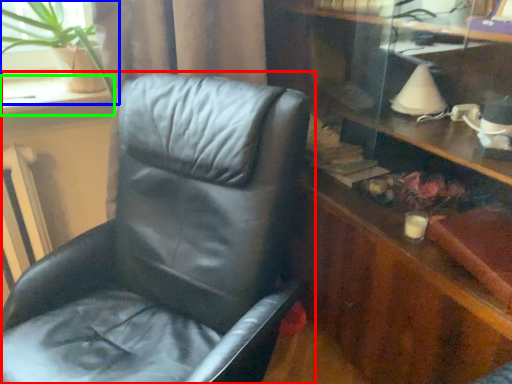
Question: Considering the real-world distances, which object is farthest from chair (highlighted by a red box)? houseplant (highlighted by a blue box) or window sill (highlighted by a green box)?

Choices:
 (A) houseplant
 (B) window sill

Answer: (B)